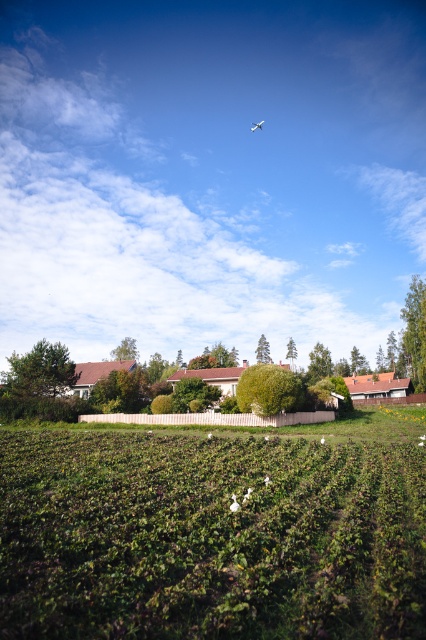
You are a drone operator trying to fly a drone between the green leafy hedge at center and the white matte airplane at upper center. Can you fit the drone between them?

The green leafy hedge at center is smaller than the white matte airplane at upper center, so the drone can fit between them as there is enough space.

You are a pilot flying a small plane and notice the green leafy field at center and the white matte airplane at upper center in the distance. Which object appears larger from your current altitude?

The white matte airplane at upper center appears larger than the green leafy field at center because the description states that the green leafy field at center has a smaller size compared to the white matte airplane at upper center.